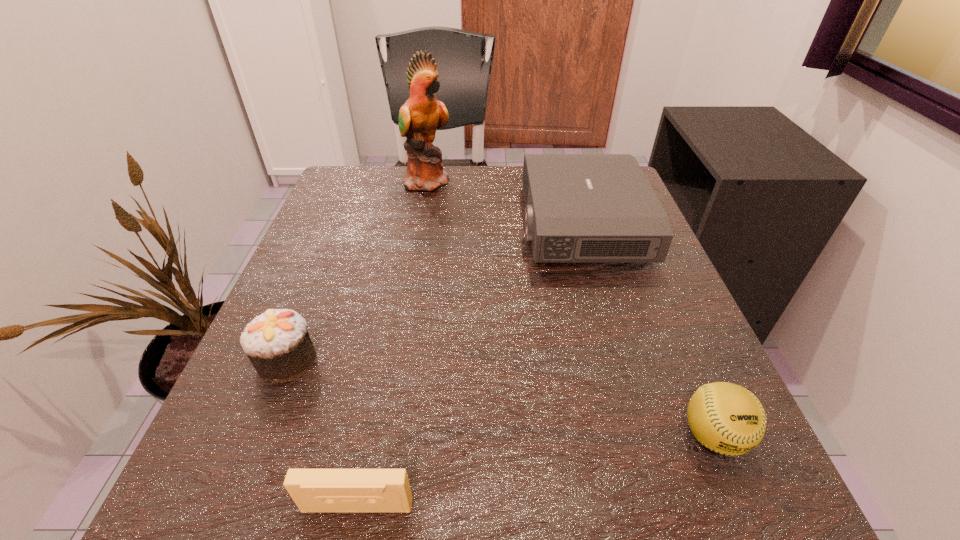
Where is `parrot`? This screenshot has height=540, width=960. parrot is located at coordinates (420, 116).

The image size is (960, 540). In order to click on projector in this screenshot , I will do `click(579, 207)`.

Image resolution: width=960 pixels, height=540 pixels. Find the location of `the leftmost object`. the leftmost object is located at coordinates (277, 343).

Locate an element on the screen. cupcake is located at coordinates (277, 343).

Locate an element on the screen. softball is located at coordinates (726, 418).

At what (x,y) coordinates should I click in order to perform the action: click on the shortest object. Please return your answer as a coordinate pair (x, y). Looking at the image, I should click on pyautogui.click(x=313, y=490).

This screenshot has width=960, height=540. Find the location of `videotape`. videotape is located at coordinates tap(313, 490).

This screenshot has height=540, width=960. I want to click on vacant area situated 0.270m on the front-facing side of the parrot, so click(561, 180).

This screenshot has height=540, width=960. I want to click on vacant region located on the front-facing side of the projector, so click(343, 225).

Find the location of `free space located on the front-facing side of the projector`. free space located on the front-facing side of the projector is located at coordinates (481, 225).